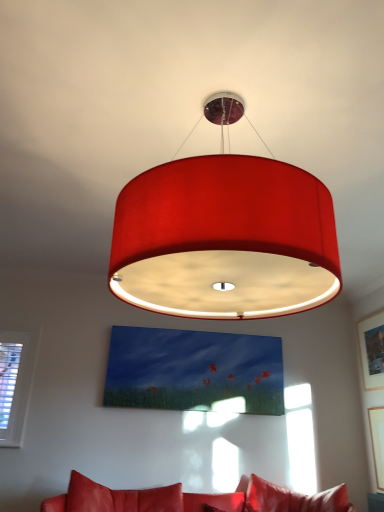
Question: From the image's perspective, is matte fabric lampshade at center positioned above or below matte white picture frame at upper right, which is the 2th picture frame in top-to-bottom order?

Choices:
 (A) below
 (B) above

Answer: (B)

Question: Is matte fabric lampshade at center inside or outside of matte white picture frame at upper right, which is the 1th picture frame in bottom-to-top order?

Choices:
 (A) outside
 (B) inside

Answer: (A)

Question: Which of these objects is positioned closest to the leather couch at lower center?

Choices:
 (A) matte white picture frame at upper right, which is the 2th picture frame in top-to-bottom order
 (B) wooden picture frame at upper right, which is the second picture frame from bottom to top
 (C) matte fabric lampshade at center

Answer: (A)

Question: Considering the real-world distances, which object is closest to the leather couch at lower center?

Choices:
 (A) matte white picture frame at upper right, which is the 2th picture frame in top-to-bottom order
 (B) wooden picture frame at upper right, the first picture frame positioned from the top
 (C) matte fabric lampshade at center

Answer: (A)